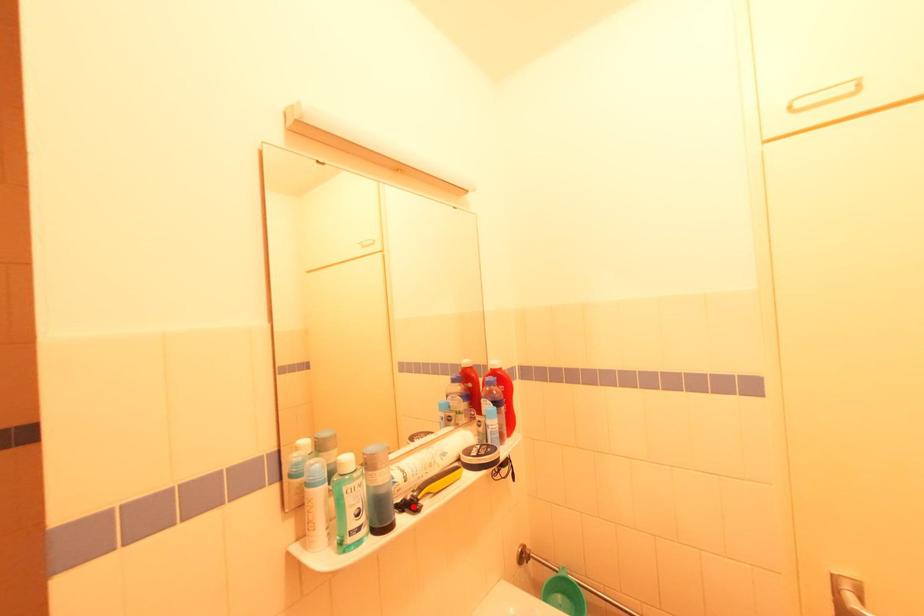
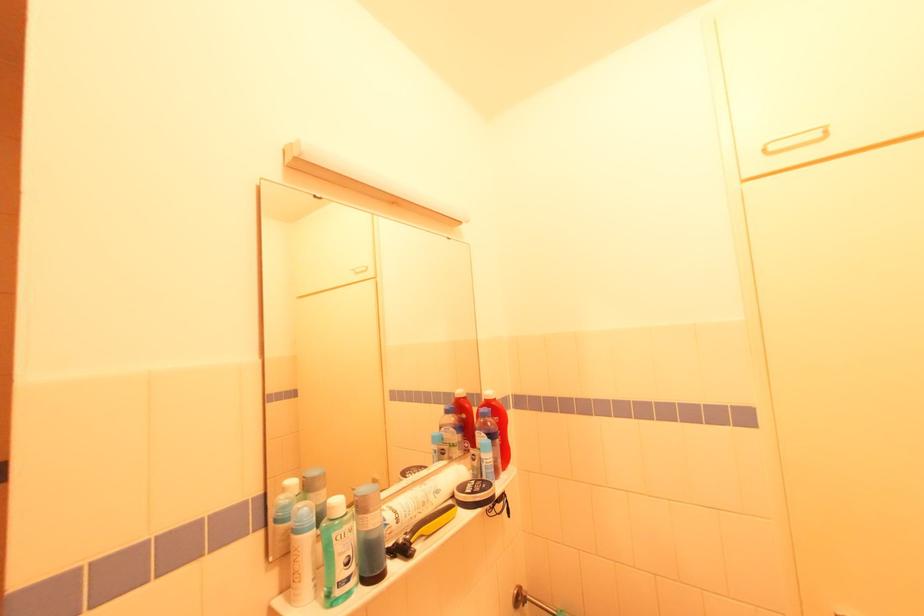
Locate, in the second image, the point that corresponds to the highlighted location in the first image.

(406, 552)